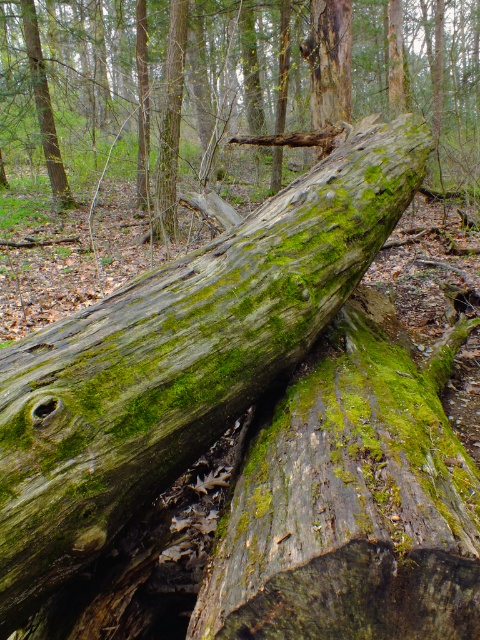
Question: Which point appears farthest from the camera in this image?

Choices:
 (A) (84, 490)
 (B) (309, 596)

Answer: (A)

Question: Which of the following is the closest to the observer?

Choices:
 (A) green mossy wood at center
 (B) green mossy wood log at center
 (C) green mossy log at center

Answer: (A)

Question: Can you confirm if green mossy wood log at center is smaller than green mossy wood at center?

Choices:
 (A) no
 (B) yes

Answer: (A)

Question: From the image, what is the correct spatial relationship of green mossy wood at center in relation to green mossy log at center?

Choices:
 (A) right
 (B) left

Answer: (A)

Question: Does green mossy wood at center appear on the left side of green mossy log at center?

Choices:
 (A) no
 (B) yes

Answer: (A)

Question: Considering the real-world distances, which object is closest to the green mossy wood log at center?

Choices:
 (A) green mossy log at center
 (B) green mossy wood at center

Answer: (B)